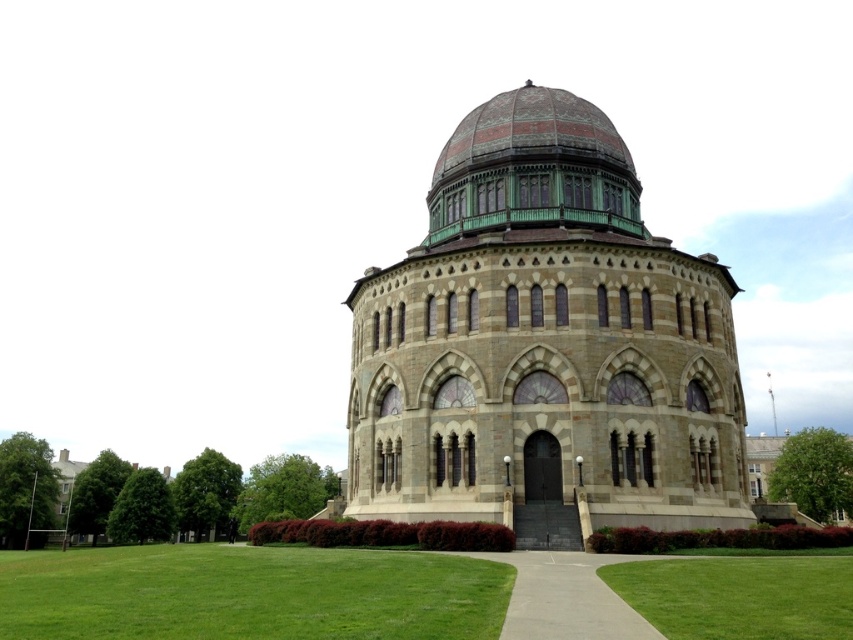
Can you confirm if bronze/golden dome at center is smaller than concrete at center?

No.

Is point (502, 106) closer to camera compared to point (566, 620)?

No, it is behind (566, 620).

Is point (491, 211) closer to viewer compared to point (637, 560)?

No, it is not.

The image size is (853, 640). In order to click on bronze/golden dome at center in this screenshot , I will do `click(532, 168)`.

Does green grass at lower right appear on the right side of concrete at center?

Correct, you'll find green grass at lower right to the right of concrete at center.

Which is behind, point (769, 588) or point (567, 589)?

Positioned behind is point (769, 588).

Find the location of `green grass at lower right`. green grass at lower right is located at coordinates (740, 595).

You are a GUI agent. You are given a task and a screenshot of the screen. Output one action in this format:
    pyautogui.click(x=<x>, y=<y>)
    Task: Click on the green grass at lower right
    
    Given the screenshot: What is the action you would take?
    pyautogui.click(x=740, y=595)

Who is positioned more to the left, stone church at center or concrete at center?

concrete at center

Where is `stone church at center`? This screenshot has width=853, height=640. stone church at center is located at coordinates (544, 342).

At what (x,y) coordinates should I click in order to perform the action: click on stone church at center. Please return your answer as a coordinate pair (x, y). The width and height of the screenshot is (853, 640). Looking at the image, I should click on click(x=544, y=342).